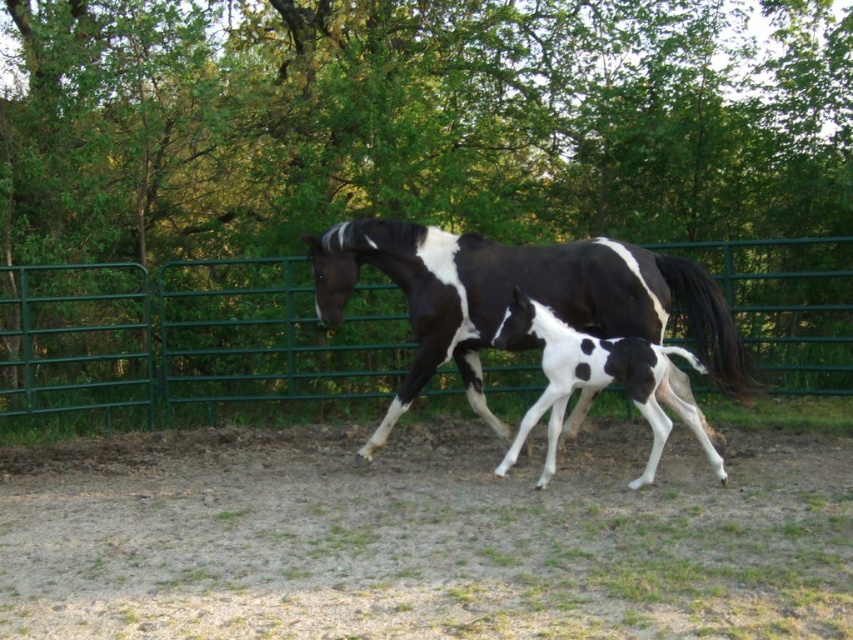
Question: Is black and white speckled horse at center above white-spotted glossy horse at center?

Choices:
 (A) no
 (B) yes

Answer: (B)

Question: Which point is closer to the camera?

Choices:
 (A) black and white speckled horse at center
 (B) green metal fence at center
 (C) white-spotted glossy horse at center

Answer: (C)

Question: Is black and white speckled horse at center thinner than white-spotted glossy horse at center?

Choices:
 (A) yes
 (B) no

Answer: (B)

Question: Is green metal fence at center thinner than white-spotted glossy horse at center?

Choices:
 (A) yes
 (B) no

Answer: (B)

Question: Which object is closer to the camera taking this photo?

Choices:
 (A) black and white speckled horse at center
 (B) white-spotted glossy horse at center
 (C) green metal fence at center

Answer: (B)

Question: Which object is closer to the camera taking this photo?

Choices:
 (A) white-spotted glossy horse at center
 (B) green metal fence at center

Answer: (A)